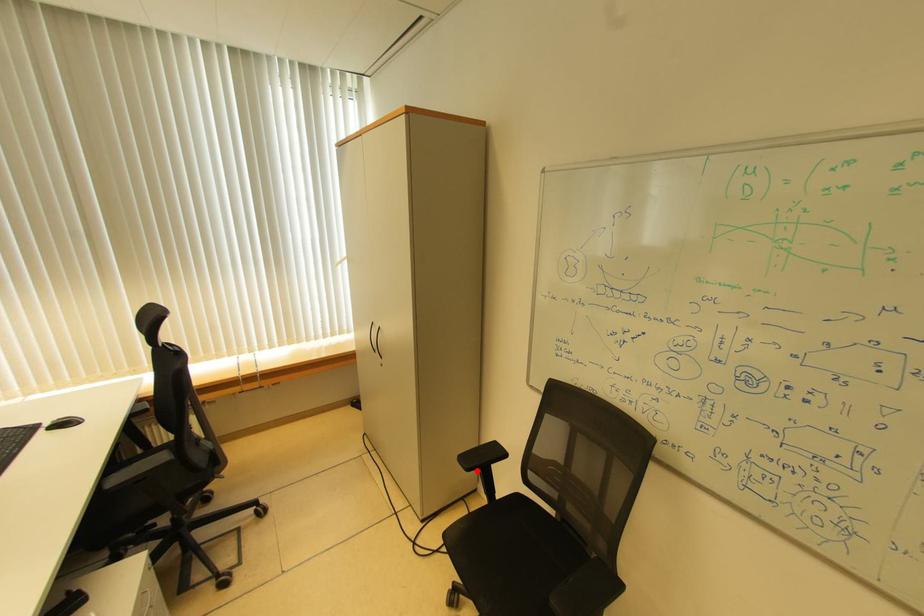
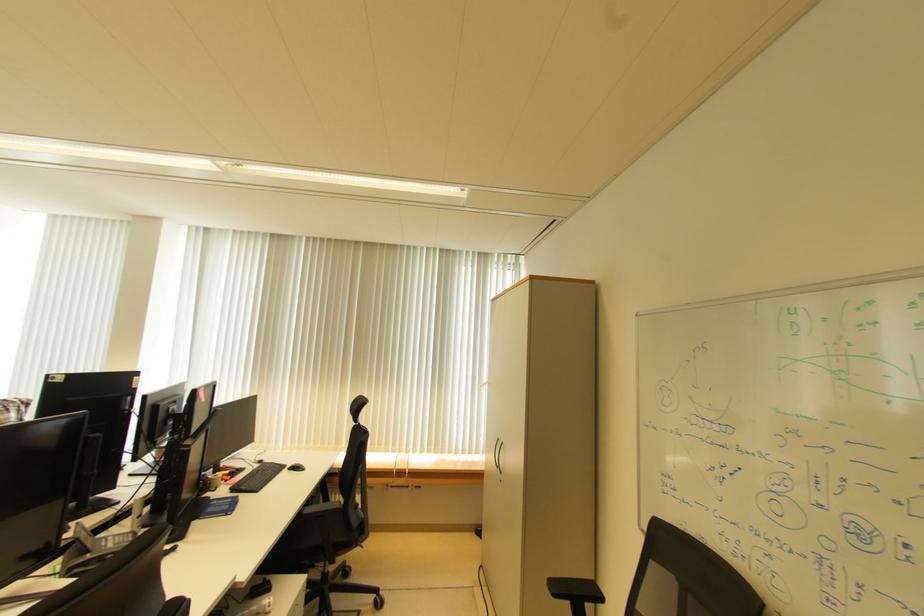
In the second image, find the point that corresponds to the highlighted location in the first image.

(564, 597)